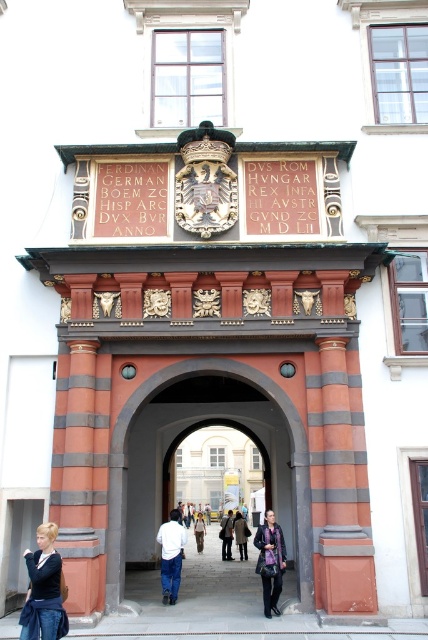
Which is more to the left, denim jacket at lower left or dark purple scarf at center?

denim jacket at lower left is more to the left.

Looking at this image, how much distance is there between denim jacket at lower left and dark purple scarf at center?

denim jacket at lower left and dark purple scarf at center are 46.33 feet apart from each other.

Which is in front, point (50, 608) or point (262, 563)?

Point (50, 608) is more forward.

Image resolution: width=428 pixels, height=640 pixels. Identify the location of denim jacket at lower left. (44, 589).

Can you confirm if terracotta striped column at lower left is taller than light brown leather jacket at center?

Correct, terracotta striped column at lower left is much taller as light brown leather jacket at center.

Is terracotta striped column at lower left thinner than light brown leather jacket at center?

No.

You are a GUI agent. You are given a task and a screenshot of the screen. Output one action in this format:
    pyautogui.click(x=<x>, y=<y>)
    Task: Click on the terracotta striped column at lower left
    
    Given the screenshot: What is the action you would take?
    pyautogui.click(x=80, y=472)

The image size is (428, 640). In order to click on terracotta striped column at lower left in this screenshot , I will do `click(80, 472)`.

Between smooth stone archway at center and terracotta brick pillar at right, which one has more height?

smooth stone archway at center

Does smooth stone archway at center appear on the left side of terracotta brick pillar at right?

Indeed, smooth stone archway at center is positioned on the left side of terracotta brick pillar at right.

This screenshot has height=640, width=428. What do you see at coordinates (190, 433) in the screenshot?
I see `smooth stone archway at center` at bounding box center [190, 433].

You are a GUI agent. You are given a task and a screenshot of the screen. Output one action in this format:
    pyautogui.click(x=<x>, y=<y>)
    Task: Click on the smooth stone archway at center
    
    Given the screenshot: What is the action you would take?
    pyautogui.click(x=190, y=433)